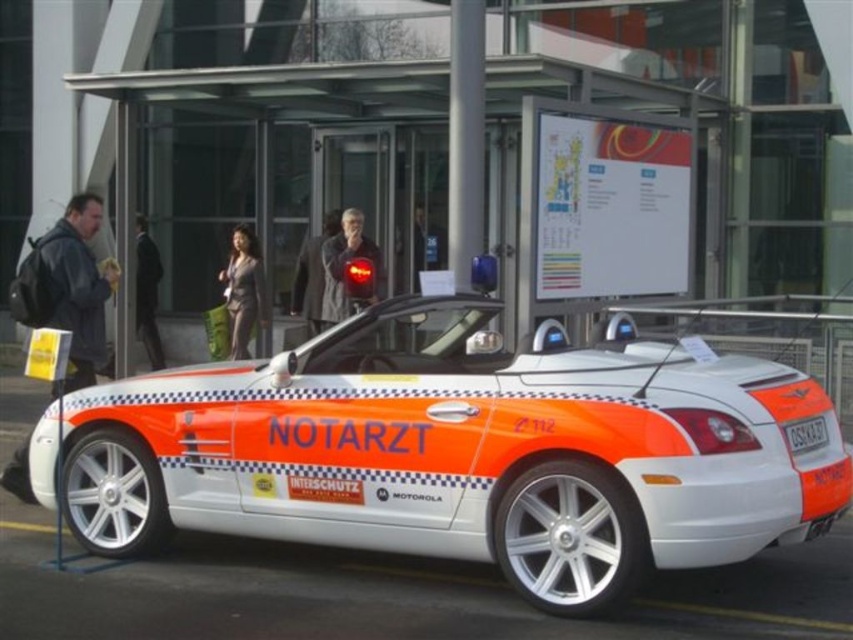
Does white metallic car at center appear over white plastic license plate at center?

Indeed, white metallic car at center is positioned over white plastic license plate at center.

The image size is (853, 640). What are the coordinates of `white metallic car at center` in the screenshot? It's located at (457, 451).

Where is `white metallic car at center`? white metallic car at center is located at coordinates (457, 451).